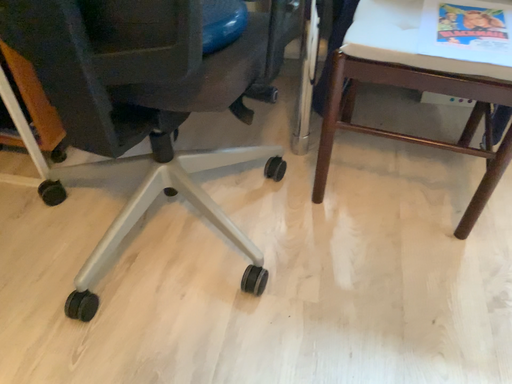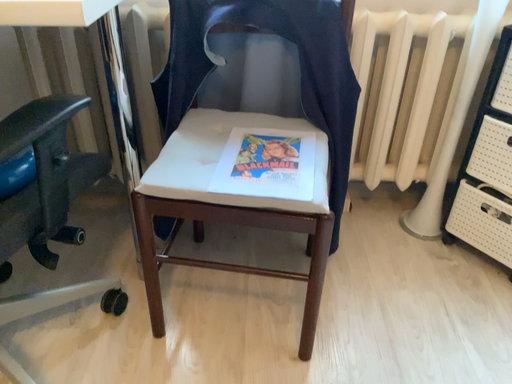
Question: Which way did the camera rotate in the video?

Choices:
 (A) rotated upward
 (B) rotated downward

Answer: (A)